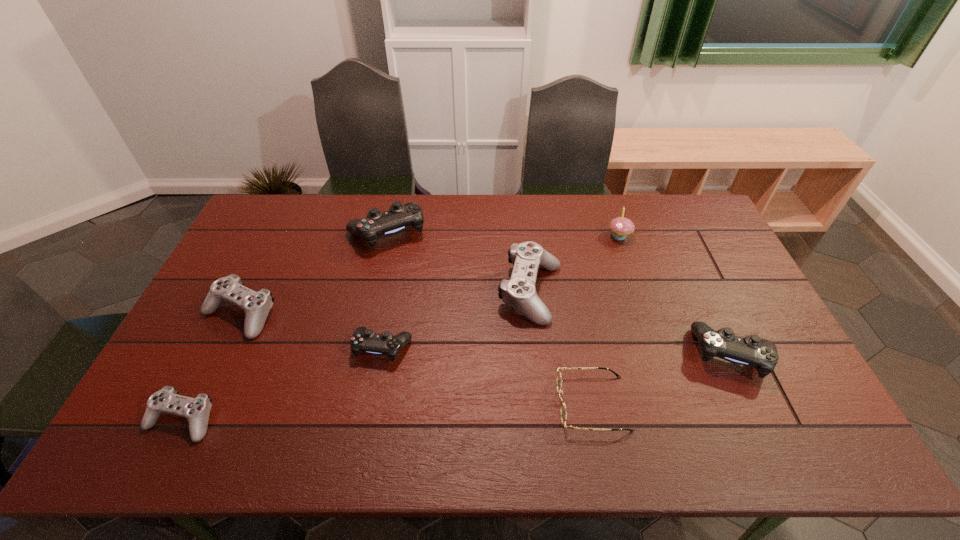
What are the coordinates of `green spectacles` in the screenshot? It's located at (563, 412).

You are a GUI agent. You are given a task and a screenshot of the screen. Output one action in this format:
    pyautogui.click(x=<x>, y=<y>)
    Task: Click on the shortest control
    The image size is (960, 540).
    Given the screenshot: What is the action you would take?
    pyautogui.click(x=197, y=410)

At what (x,y) coordinates should I click in order to perform the action: click on the nearest white control. Please return your answer as a coordinate pair (x, y). The width and height of the screenshot is (960, 540). Looking at the image, I should click on (197, 410).

Where is `vacant space located 0.180m on the right of the pink cupcake`? The width and height of the screenshot is (960, 540). vacant space located 0.180m on the right of the pink cupcake is located at coordinates (683, 237).

The image size is (960, 540). What are the coordinates of `vacant space located on the front of the farthest control` in the screenshot? It's located at (372, 303).

This screenshot has height=540, width=960. Identify the location of vacant area situated 0.320m on the left of the second control from right to left. (394, 292).

Find the location of a particular element. Image resolution: width=960 pixels, height=540 pixels. vacant area situated on the left of the rightmost object is located at coordinates (597, 354).

Identify the location of vacant space located on the right of the second smallest white control. 347,314.

Locate an element on the screen. The height and width of the screenshot is (540, 960). free space located 0.340m on the left of the smallest black control is located at coordinates (231, 347).

At what (x,y) coordinates should I click in order to perform the action: click on vacant area located on the lenses of the spectacles. Please return your answer as a coordinate pair (x, y). This screenshot has width=960, height=540. Looking at the image, I should click on (521, 403).